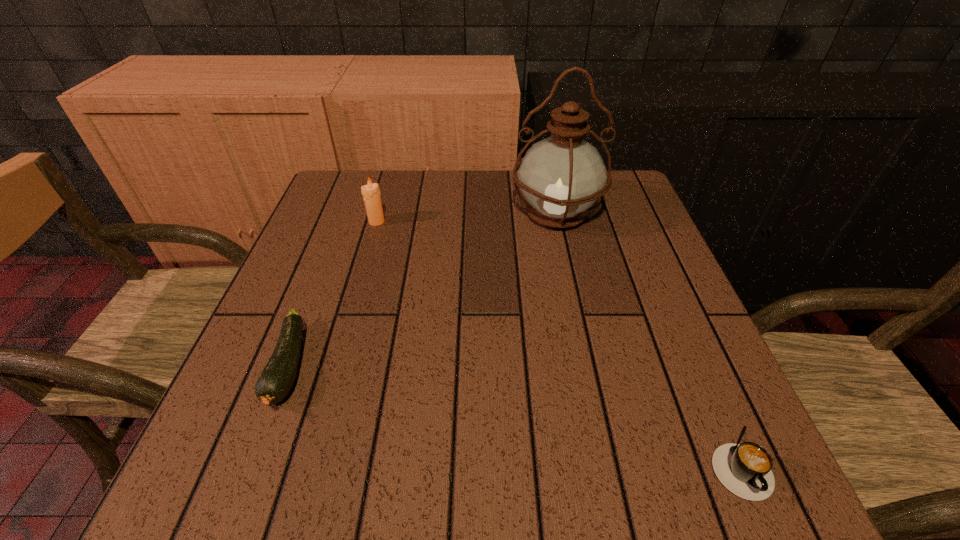
At what (x,y) coordinates should I click in order to perform the action: click on object that is positioned at the near right corner. Please return your answer as a coordinate pair (x, y). Looking at the image, I should click on (744, 469).

In the image, there is a desktop. Where is `vacant space at the far edge`? The height and width of the screenshot is (540, 960). vacant space at the far edge is located at coordinates (452, 205).

Where is `vacant space at the near edge`? The height and width of the screenshot is (540, 960). vacant space at the near edge is located at coordinates (508, 449).

This screenshot has height=540, width=960. In the image, there is a desktop. Find the location of `vacant space at the left edge`. vacant space at the left edge is located at coordinates tap(346, 316).

Identify the location of vacant area at the right edge of the desktop. (628, 224).

You are a GUI agent. You are given a task and a screenshot of the screen. Output one action in this format:
    pyautogui.click(x=<x>, y=<y>)
    Task: Click on the free point at the far left corner
    
    Given the screenshot: What is the action you would take?
    pyautogui.click(x=355, y=191)

Where is `vacant space at the near left corner of the desktop`? vacant space at the near left corner of the desktop is located at coordinates (210, 492).

Find the location of a particular element. unoccupied position between the second object from left to right and the oil lamp is located at coordinates (467, 218).

You are a GUI agent. You are given a task and a screenshot of the screen. Output one action in this format:
    pyautogui.click(x=<x>, y=<y>)
    Task: Click on the empty space that is in between the third shortest object and the oil lamp
    Image resolution: width=960 pixels, height=540 pixels.
    Given the screenshot: What is the action you would take?
    pyautogui.click(x=467, y=218)

Identify the location of empty space between the second object from left to right and the nearest object. (557, 342).